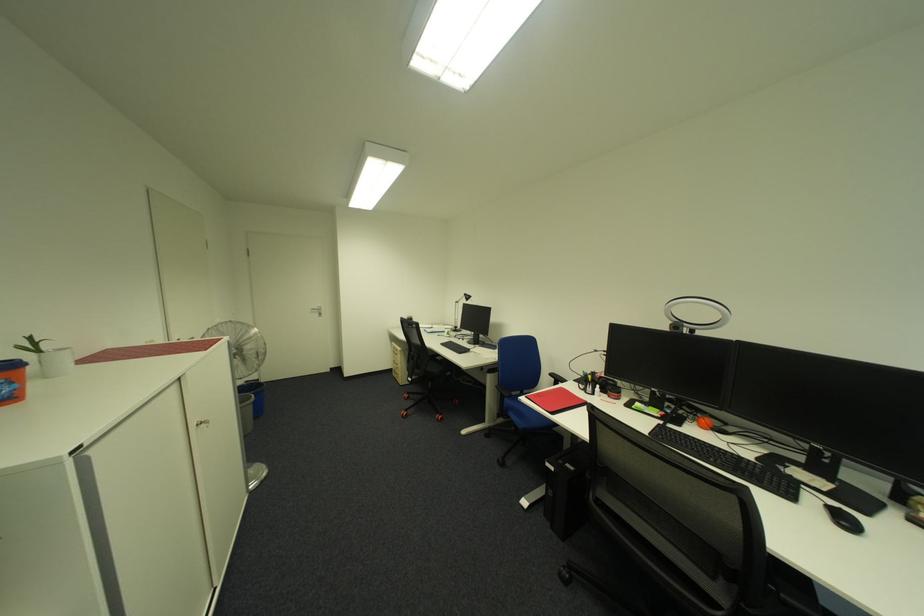
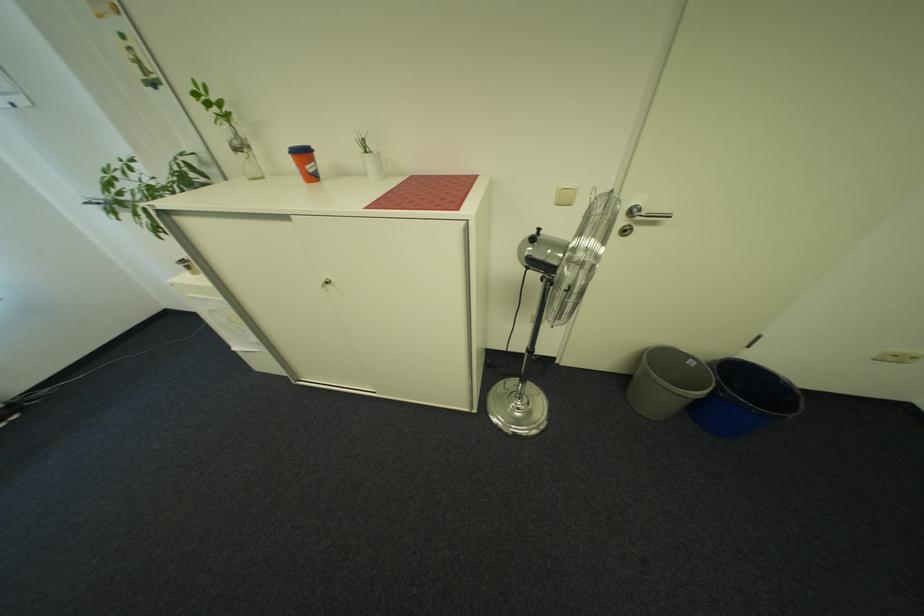
Find the pixel in the second image that matches point (263, 403) in the first image.

(707, 403)